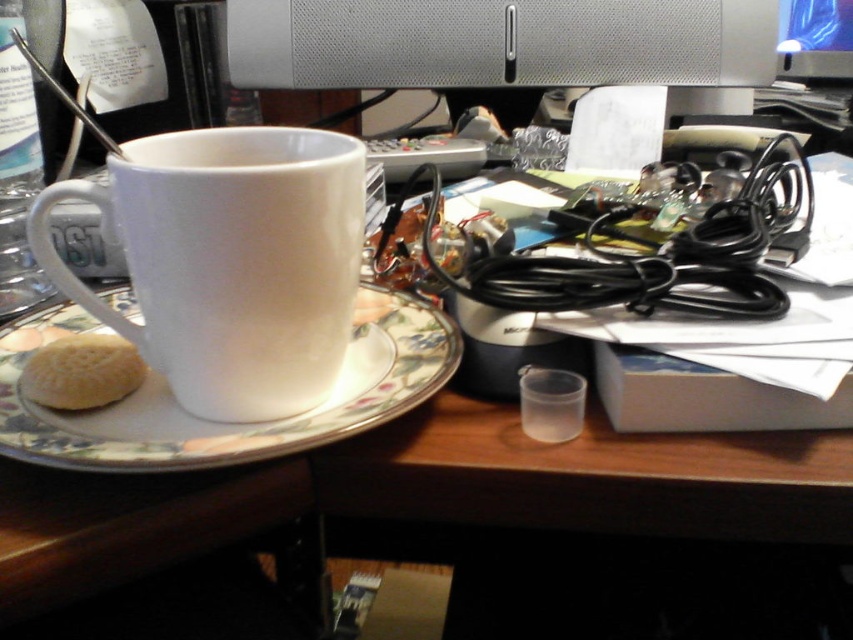
Which is above, white matte mug at center or porcelain saucer at center?

Positioned higher is white matte mug at center.

Does white matte mug at center lie in front of porcelain saucer at center?

No, white matte mug at center is further to the viewer.

Where is `white matte mug at center`? white matte mug at center is located at coordinates (229, 260).

Locate an element on the screen. The image size is (853, 640). white matte mug at center is located at coordinates (229, 260).

Which is above, porcelain saucer at center or white matte biscuit at lower left?

porcelain saucer at center is higher up.

Is point (421, 353) farther from camera compared to point (24, 365)?

No, it is not.

Which is in front, point (15, 344) or point (68, 360)?

Point (68, 360) is in front.

Find the location of `porcelain saucer at center`. porcelain saucer at center is located at coordinates tap(225, 422).

Which is more to the right, white matte mug at center or white matte biscuit at lower left?

white matte mug at center

Which is below, white matte mug at center or white matte biscuit at lower left?

Positioned lower is white matte biscuit at lower left.

The width and height of the screenshot is (853, 640). I want to click on white matte mug at center, so click(229, 260).